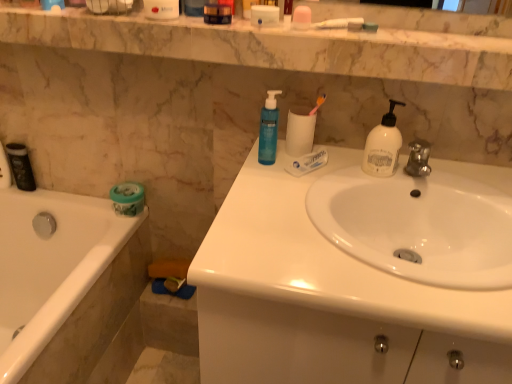
Measure the distance between point [31,255] and camera.

The depth of point [31,255] is 4.97 feet.

The width and height of the screenshot is (512, 384). I want to click on green matte jar at lower left, arranged as the second toilet paper when viewed from the front, so click(127, 198).

Describe the element at coordinates (127, 198) in the screenshot. I see `green matte jar at lower left, the first toilet paper in the back-to-front sequence` at that location.

Describe the element at coordinates (326, 299) in the screenshot. I see `white glossy sink at center, which ranks as the first sink in bottom-to-top order` at that location.

What do you see at coordinates (268, 129) in the screenshot? I see `blue translucent pump bottle at upper center, the 2th soap dispenser positioned from the right` at bounding box center [268, 129].

At what (x,y) coordinates should I click in order to perform the action: click on white glossy sink at center, acting as the 1th sink starting from the top. Please return your answer as a coordinate pair (x, y). Looking at the image, I should click on (422, 223).

Describe the element at coordinates (383, 146) in the screenshot. I see `white matte soap dispenser at upper right, positioned as the 2th soap dispenser in left-to-right order` at that location.

Describe the element at coordinates (203, 35) in the screenshot. This screenshot has width=512, height=384. I see `marble at upper center` at that location.

The image size is (512, 384). Identify the location of white glossy bathtub at left. (65, 283).

Which of these two, black matte canister at left or blue translucent pump bottle at upper center, positioned as the first soap dispenser in left-to-right order, stands taller?

Standing taller between the two is blue translucent pump bottle at upper center, positioned as the first soap dispenser in left-to-right order.

Where is `the 1st soap dispenser counting from the right side of the black matte canister at left`? the 1st soap dispenser counting from the right side of the black matte canister at left is located at coordinates (268, 129).

Which is behind, point (32, 181) or point (270, 153)?

Positioned behind is point (32, 181).

From the picture: Which object is positioned more to the left, white glossy sink at center, positioned as the 2th sink in top-to-bottom order, or white matte toilet paper at center, which is the second toilet paper in bottom-to-top order?

white matte toilet paper at center, which is the second toilet paper in bottom-to-top order, is more to the left.

Looking at this image, is white glossy sink at center, positioned as the 2th sink in top-to-bottom order, thinner than white matte toilet paper at center, which appears as the 1th toilet paper when viewed from the front?

In fact, white glossy sink at center, positioned as the 2th sink in top-to-bottom order, might be wider than white matte toilet paper at center, which appears as the 1th toilet paper when viewed from the front.

Measure the distance between white glossy sink at center, which ranks as the first sink in bottom-to-top order, and white matte toilet paper at center, which is the first toilet paper in right-to-left order.

white glossy sink at center, which ranks as the first sink in bottom-to-top order, and white matte toilet paper at center, which is the first toilet paper in right-to-left order, are 15.49 inches apart.

From a real-world perspective, who is located higher, white glossy sink at center, positioned as the 2th sink in top-to-bottom order, or white matte toilet paper at center, which is the 2th toilet paper in back-to-front order?

white matte toilet paper at center, which is the 2th toilet paper in back-to-front order, is physically above.

In the scene shown: What's the angular difference between white matte soap dispenser at upper right, the first soap dispenser viewed from the right, and translucent white tube at center's facing directions?

52.1 degrees separate the facing orientations of white matte soap dispenser at upper right, the first soap dispenser viewed from the right, and translucent white tube at center.

Between white matte soap dispenser at upper right, positioned as the 2th soap dispenser in left-to-right order, and translucent white tube at center, which one appears on the right side from the viewer's perspective?

white matte soap dispenser at upper right, positioned as the 2th soap dispenser in left-to-right order, is more to the right.

Is white matte soap dispenser at upper right, the first soap dispenser viewed from the right, positioned with its back to translucent white tube at center?

No, white matte soap dispenser at upper right, the first soap dispenser viewed from the right, is not facing away from translucent white tube at center.

From the image's perspective, is blue translucent pump bottle at upper center, positioned as the first soap dispenser in left-to-right order, over white glossy bathtub at left?

Correct, blue translucent pump bottle at upper center, positioned as the first soap dispenser in left-to-right order, appears higher than white glossy bathtub at left in the image.

Could you tell me if blue translucent pump bottle at upper center, the 2th soap dispenser positioned from the right, is turned towards white glossy bathtub at left?

No.

Which object is closer to the camera taking this photo, blue translucent pump bottle at upper center, the 2th soap dispenser positioned from the right, or white glossy bathtub at left?

white glossy bathtub at left.

I want to click on toilet paper below the white matte soap dispenser at upper right, positioned as the 2th soap dispenser in left-to-right order (from the image's perspective), so (127, 198).

Between green matte jar at lower left, the second toilet paper viewed from the right, and white matte soap dispenser at upper right, the first soap dispenser viewed from the right, which one has smaller width?

Thinner between the two is white matte soap dispenser at upper right, the first soap dispenser viewed from the right.

Based on their positions, is green matte jar at lower left, arranged as the second toilet paper when viewed from the front, located to the left or right of white matte soap dispenser at upper right, the first soap dispenser viewed from the right?

In the image, green matte jar at lower left, arranged as the second toilet paper when viewed from the front, appears on the left side of white matte soap dispenser at upper right, the first soap dispenser viewed from the right.

How many degrees apart are the facing directions of green matte jar at lower left, the 2th toilet paper positioned from the top, and white matte soap dispenser at upper right, the first soap dispenser viewed from the right?

The angular difference between green matte jar at lower left, the 2th toilet paper positioned from the top, and white matte soap dispenser at upper right, the first soap dispenser viewed from the right, is 2.24 degrees.

Is green matte jar at lower left, which appears as the first toilet paper when ordered from the bottom, outside of blue translucent pump bottle at upper center, the 2th soap dispenser positioned from the right?

green matte jar at lower left, which appears as the first toilet paper when ordered from the bottom, lies outside blue translucent pump bottle at upper center, the 2th soap dispenser positioned from the right,'s area.

Considering the sizes of objects green matte jar at lower left, the first toilet paper in the back-to-front sequence, and blue translucent pump bottle at upper center, positioned as the first soap dispenser in left-to-right order, in the image provided, who is bigger, green matte jar at lower left, the first toilet paper in the back-to-front sequence, or blue translucent pump bottle at upper center, positioned as the first soap dispenser in left-to-right order,?

With larger size is green matte jar at lower left, the first toilet paper in the back-to-front sequence.

From the image's perspective, is green matte jar at lower left, arranged as the second toilet paper when viewed from the front, located above or below blue translucent pump bottle at upper center, the 2th soap dispenser positioned from the right?

Based on their image positions, green matte jar at lower left, arranged as the second toilet paper when viewed from the front, is located beneath blue translucent pump bottle at upper center, the 2th soap dispenser positioned from the right.

Can you tell me how much green matte jar at lower left, the 1th toilet paper viewed from the left, and blue translucent pump bottle at upper center, positioned as the first soap dispenser in left-to-right order, differ in facing direction?

The angular difference between green matte jar at lower left, the 1th toilet paper viewed from the left, and blue translucent pump bottle at upper center, positioned as the first soap dispenser in left-to-right order, is 1.42 degrees.

Considering the relative sizes of green matte jar at lower left, the first toilet paper in the back-to-front sequence, and white matte toilet paper at center, which is the 2th toilet paper in back-to-front order, in the image provided, is green matte jar at lower left, the first toilet paper in the back-to-front sequence, wider than white matte toilet paper at center, which is the 2th toilet paper in back-to-front order,?

Yes.

Could you tell me if green matte jar at lower left, which appears as the first toilet paper when ordered from the bottom, is facing white matte toilet paper at center, which appears as the 1th toilet paper when viewed from the front?

No, green matte jar at lower left, which appears as the first toilet paper when ordered from the bottom, is not oriented towards white matte toilet paper at center, which appears as the 1th toilet paper when viewed from the front.

Is green matte jar at lower left, arranged as the second toilet paper when viewed from the front, beside white matte toilet paper at center, which is the 2th toilet paper in back-to-front order?

No, green matte jar at lower left, arranged as the second toilet paper when viewed from the front, is not next to white matte toilet paper at center, which is the 2th toilet paper in back-to-front order.

You are a GUI agent. You are given a task and a screenshot of the screen. Output one action in this format:
    pyautogui.click(x=<x>, y=<y>)
    Task: Click on the 1st soap dispenser positioned above the black matte canister at left (from a real-world perspective)
    The width and height of the screenshot is (512, 384).
    Given the screenshot: What is the action you would take?
    pyautogui.click(x=268, y=129)

From a real-world perspective, count 2nd sinks downward from the white matte toilet paper at center, arranged as the first toilet paper when viewed from the top, and point to it. Please provide its 2D coordinates.

[(326, 299)]

Estimate the real-world distances between objects in this image. Which object is further from green matte jar at lower left, the second toilet paper viewed from the right, blue translucent pump bottle at upper center, the 2th soap dispenser positioned from the right, or translucent white tube at center?

translucent white tube at center is further to green matte jar at lower left, the second toilet paper viewed from the right.

Based on the photo, when comparing their distances from white glossy bathtub at left, does white matte toilet paper at center, which is the first toilet paper in right-to-left order, or white matte soap dispenser at upper right, the first soap dispenser viewed from the right, seem closer?

Based on the image, white matte toilet paper at center, which is the first toilet paper in right-to-left order, appears to be nearer to white glossy bathtub at left.

Based on their spatial positions, is translucent white tube at center or marble at upper center further from green matte jar at lower left, the 2th toilet paper positioned from the top?

marble at upper center lies further to green matte jar at lower left, the 2th toilet paper positioned from the top, than the other object.

Which object lies nearer to the anchor point white glossy sink at center, which ranks as the first sink in bottom-to-top order, green matte jar at lower left, which appears as the first toilet paper when ordered from the bottom, or translucent white tube at center?

translucent white tube at center is closer to white glossy sink at center, which ranks as the first sink in bottom-to-top order.

Consider the image. Which object lies nearer to the anchor point white glossy sink at center, which ranks as the first sink in bottom-to-top order, white glossy bathtub at left or white glossy sink at center, the second sink in the bottom-to-top sequence?

The object closer to white glossy sink at center, which ranks as the first sink in bottom-to-top order, is white glossy sink at center, the second sink in the bottom-to-top sequence.

Which object lies nearer to the anchor point blue translucent pump bottle at upper center, positioned as the first soap dispenser in left-to-right order, white matte toilet paper at center, arranged as the first toilet paper when viewed from the top, or white glossy bathtub at left?

Among the two, white matte toilet paper at center, arranged as the first toilet paper when viewed from the top, is located nearer to blue translucent pump bottle at upper center, positioned as the first soap dispenser in left-to-right order.

From the image, which object appears to be nearer to green matte jar at lower left, the 1th toilet paper viewed from the left, white matte soap dispenser at upper right, positioned as the 2th soap dispenser in left-to-right order, or white glossy bathtub at left?

Based on the image, white glossy bathtub at left appears to be nearer to green matte jar at lower left, the 1th toilet paper viewed from the left.

Which object lies further to the anchor point black matte canister at left, white glossy sink at center, which ranks as the first sink in bottom-to-top order, or green matte jar at lower left, the first toilet paper in the back-to-front sequence?

white glossy sink at center, which ranks as the first sink in bottom-to-top order, is positioned further to the anchor black matte canister at left.

Find the location of `bathtub located between black matte canister at left and white glossy sink at center, acting as the 1th sink starting from the top, in the left-right direction`. bathtub located between black matte canister at left and white glossy sink at center, acting as the 1th sink starting from the top, in the left-right direction is located at coordinates (65, 283).

Locate an element on the screen. The width and height of the screenshot is (512, 384). toothpaste between white matte toilet paper at center, which is the 2th toilet paper in back-to-front order, and white glossy sink at center, positioned as the 2th sink in top-to-bottom order, in the vertical direction is located at coordinates (307, 162).

Find the location of a particular element. The image size is (512, 384). toothpaste situated between green matte jar at lower left, the second toilet paper viewed from the right, and white glossy sink at center, which ranks as the first sink in bottom-to-top order, from left to right is located at coordinates (307, 162).

The width and height of the screenshot is (512, 384). What are the coordinates of `sink between blue translucent pump bottle at upper center, the 2th soap dispenser positioned from the right, and white glossy sink at center, which ranks as the first sink in bottom-to-top order, in the vertical direction` in the screenshot? It's located at (422, 223).